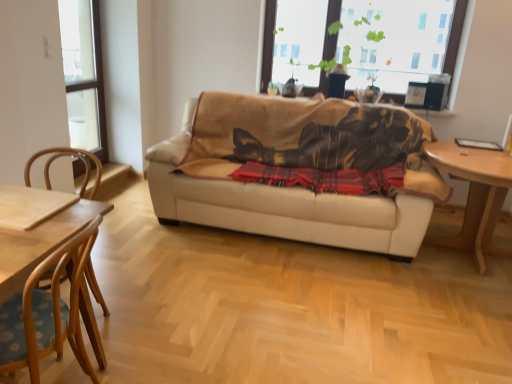
I want to click on vacant area that lies between light wood chair at left, which is counted as the first chair, starting from the back, and light brown wooden table at right, so click(288, 289).